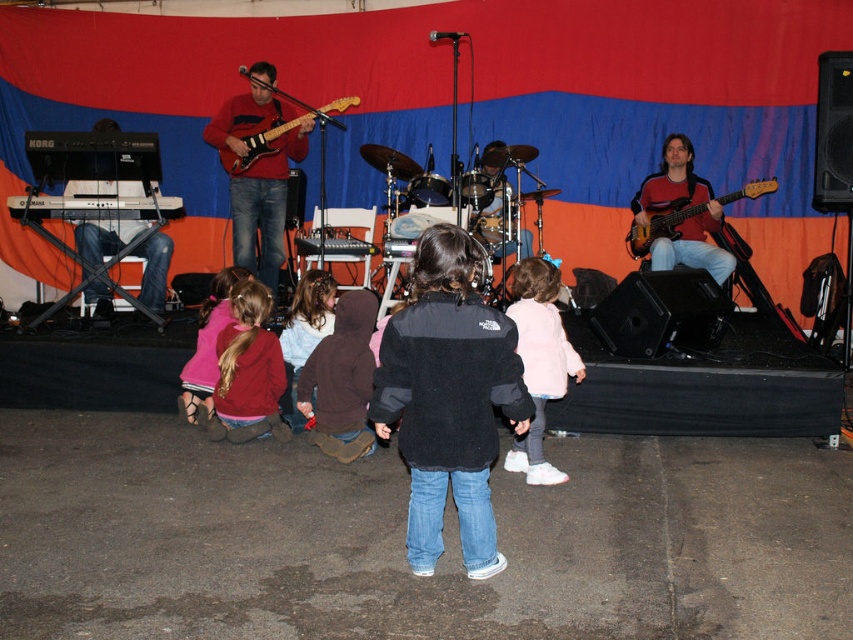
Question: Does pink fleece jacket at lower left have a greater width compared to matte electric guitar at center?

Choices:
 (A) yes
 (B) no

Answer: (B)

Question: Which of the following is the closest to the observer?

Choices:
 (A) 714,216
 (B) 268,266
 (C) 705,202
 (D) 286,346

Answer: (D)

Question: Does matte red guitar at right lie behind matte electric guitar at center?

Choices:
 (A) yes
 (B) no

Answer: (A)

Question: Which of the following is the farthest from the observer?

Choices:
 (A) velvet maroon hoodie at lower left
 (B) matte electric guitar at center
 (C) matte red electric guitar at right
 (D) matte red guitar at right

Answer: (D)

Question: Which object is closer to the camera taking this photo?

Choices:
 (A) matte red electric guitar at left
 (B) brown suede jacket at center
 (C) pale pink fleece jacket at center

Answer: (C)

Question: Does light pink fleece jacket at center come in front of matte electric guitar at center?

Choices:
 (A) yes
 (B) no

Answer: (A)